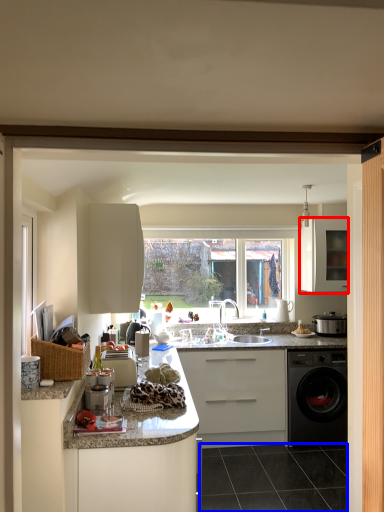
Question: Which object appears farthest to the camera in this image, cabinetry (highlighted by a red box) or tile (highlighted by a blue box)?

Choices:
 (A) cabinetry
 (B) tile

Answer: (A)